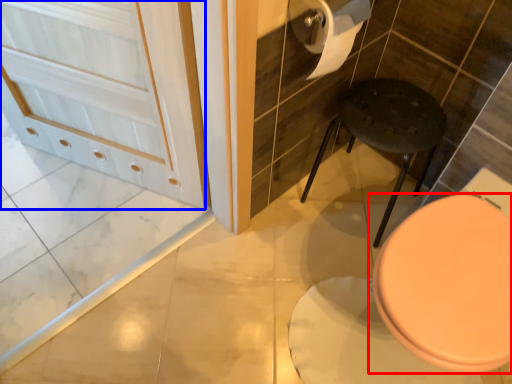
Question: Which object is closer to the camera taking this photo, toilet (highlighted by a red box) or screen door (highlighted by a blue box)?

Choices:
 (A) toilet
 (B) screen door

Answer: (A)